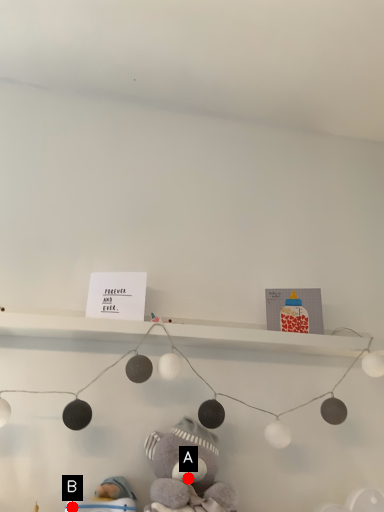
Question: Two points are circled on the image, labeled by A and B beside each circle. Which point appears farthest from the camera in this image?

Choices:
 (A) A is further
 (B) B is further

Answer: (B)